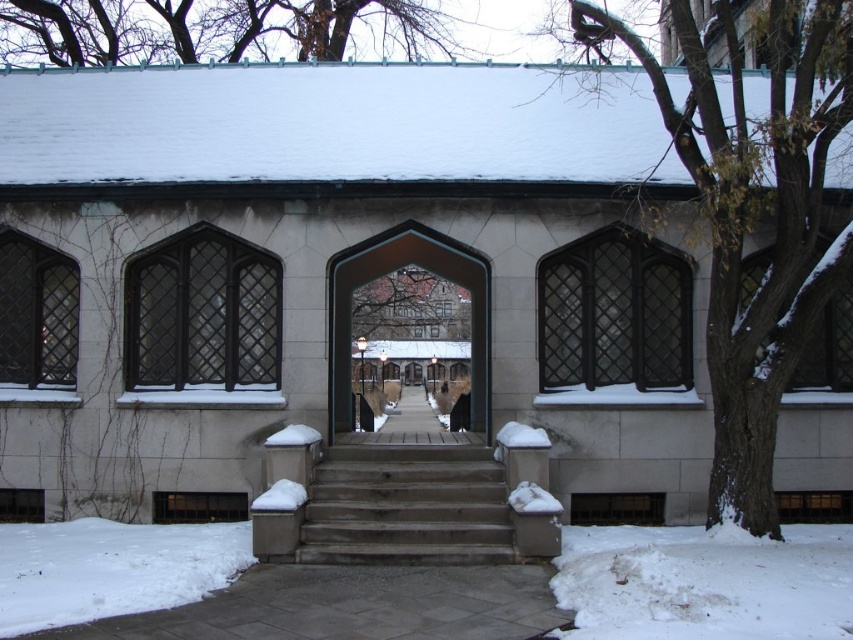
Question: Can you confirm if wooden stairs at center is positioned below white powdery snow at lower left?

Choices:
 (A) no
 (B) yes

Answer: (A)

Question: Is wooden stairs at center positioned behind white powdery snow at lower left?

Choices:
 (A) yes
 (B) no

Answer: (A)

Question: Which object is closer to the camera taking this photo?

Choices:
 (A) wooden stairs at center
 (B) white powdery snow at lower left

Answer: (B)

Question: Is wooden stairs at center to the right of white powdery snow at lower left from the viewer's perspective?

Choices:
 (A) no
 (B) yes

Answer: (B)